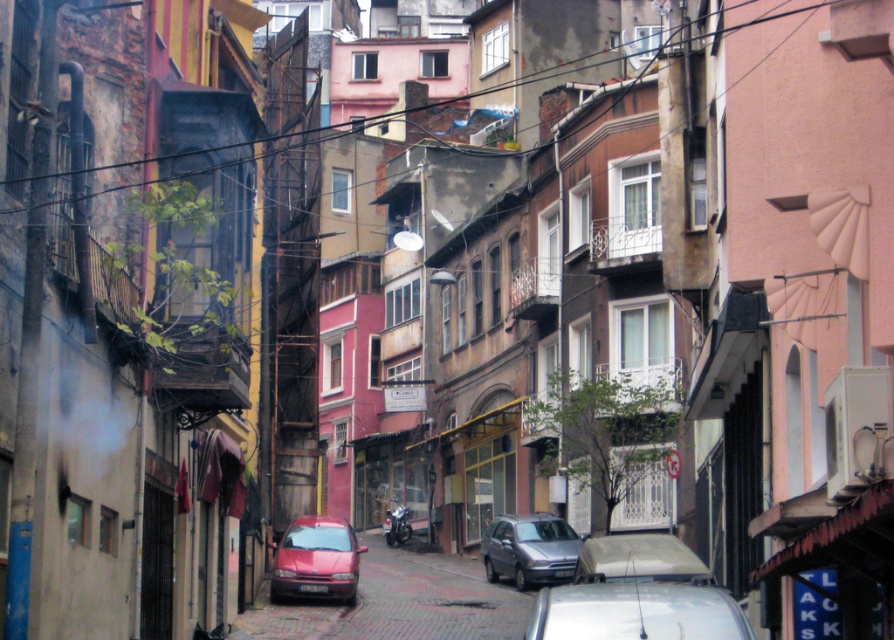
Question: Which is farther from the shiny red car at center?

Choices:
 (A) silver metallic hatchback at center
 (B) white glossy car at center
 (C) metallic red car at center
 (D) metallic silver car at center

Answer: (B)

Question: Observing the image, what is the correct spatial positioning of shiny red car at center in reference to silver metallic hatchback at center?

Choices:
 (A) left
 (B) right

Answer: (A)

Question: Among these objects, which one is farthest from the camera?

Choices:
 (A) shiny red car at center
 (B) metallic red car at center
 (C) silver metallic hatchback at center

Answer: (C)

Question: Can you confirm if white glossy car at center is smaller than metallic silver car at center?

Choices:
 (A) no
 (B) yes

Answer: (A)

Question: Is white glossy car at center positioned in front of shiny red car at center?

Choices:
 (A) no
 (B) yes

Answer: (B)

Question: Estimate the real-world distances between objects in this image. Which object is farther from the white glossy car at center?

Choices:
 (A) shiny red car at center
 (B) silver metallic hatchback at center
 (C) metallic silver car at center

Answer: (A)